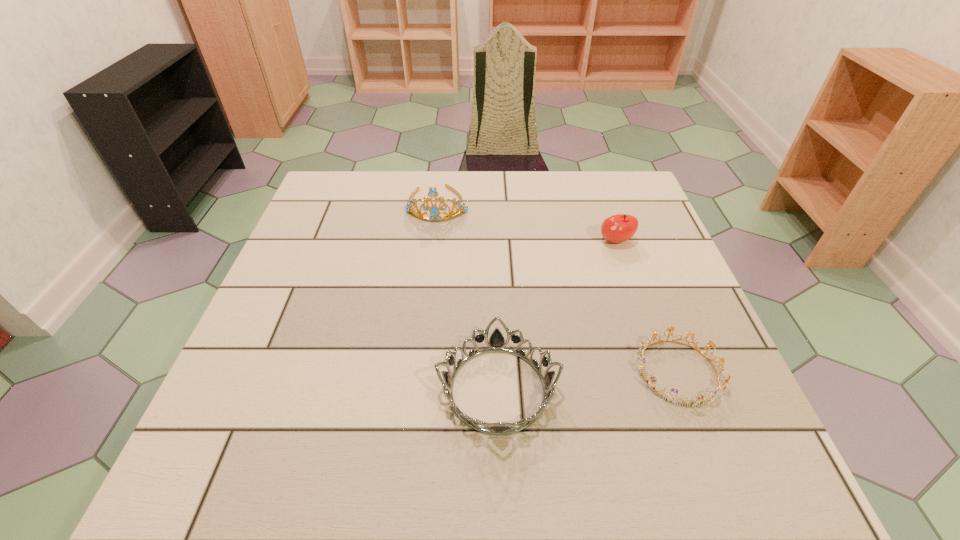
In order to click on the farthest object in this screenshot , I will do `click(434, 212)`.

Locate an element on the screen. The image size is (960, 540). the farthest tiara is located at coordinates (434, 212).

This screenshot has width=960, height=540. Find the location of `apple`. apple is located at coordinates (618, 228).

Image resolution: width=960 pixels, height=540 pixels. Identify the location of the second shortest tiara. (496, 343).

The image size is (960, 540). Find the location of `the rightmost tiara`. the rightmost tiara is located at coordinates (689, 402).

You are a GUI agent. You are given a task and a screenshot of the screen. Output one action in this format:
    pyautogui.click(x=<x>, y=<y>)
    Task: Click on the shortest tiara
    The image size is (960, 540).
    Given the screenshot: What is the action you would take?
    pyautogui.click(x=689, y=402)

Find the location of a particular element. Image resolution: width=960 pixels, height=540 pixels. vacant space located 0.090m on the front-facing side of the farthest object is located at coordinates (433, 245).

Where is `blank space located on the left of the apple`? blank space located on the left of the apple is located at coordinates (570, 241).

I want to click on vacant space located 0.130m on the front-facing side of the shortest tiara, so click(722, 485).

Locate an element on the screen. object at the far edge is located at coordinates (434, 212).